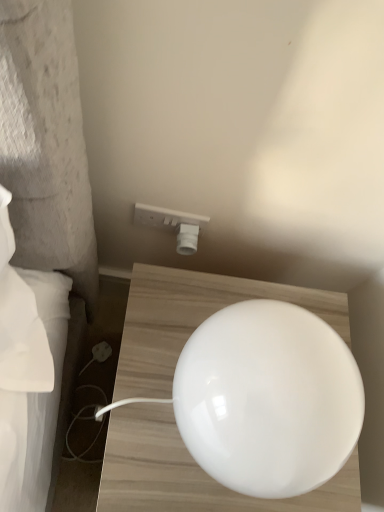
Question: From a real-world perspective, is white plastic electrical outlet at upper center above or below white glossy lampshade at center?

Choices:
 (A) below
 (B) above

Answer: (A)

Question: Is white plastic electrical outlet at upper center wider or thinner than white glossy lampshade at center?

Choices:
 (A) thin
 (B) wide

Answer: (A)

Question: Is white plastic electrical outlet at upper center taller or shorter than white glossy lampshade at center?

Choices:
 (A) tall
 (B) short

Answer: (B)

Question: Is white glossy lampshade at center in front of or behind white plastic electrical outlet at upper center in the image?

Choices:
 (A) front
 (B) behind

Answer: (A)

Question: Considering the positions of white glossy lampshade at center and white plastic electrical outlet at upper center in the image, is white glossy lampshade at center wider or thinner than white plastic electrical outlet at upper center?

Choices:
 (A) thin
 (B) wide

Answer: (B)

Question: Would you say white glossy lampshade at center is to the left or to the right of white plastic electrical outlet at upper center in the picture?

Choices:
 (A) left
 (B) right

Answer: (B)

Question: From their relative heights in the image, would you say white glossy lampshade at center is taller or shorter than white plastic electrical outlet at upper center?

Choices:
 (A) tall
 (B) short

Answer: (A)